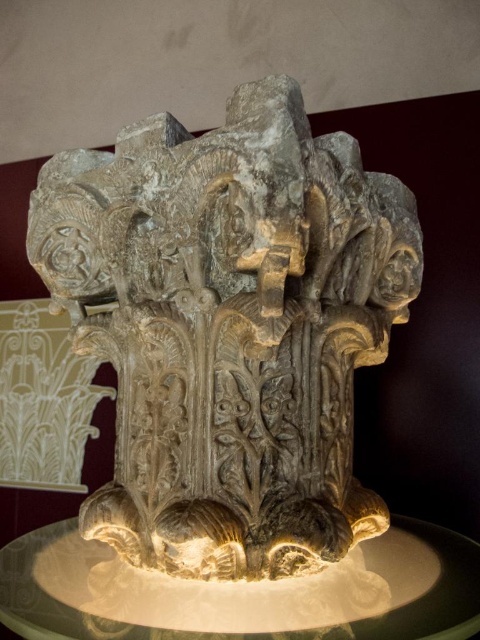
Does carved stone sculpture at center appear over satin gold pedestal at center?

Correct, carved stone sculpture at center is located above satin gold pedestal at center.

Can you confirm if carved stone sculpture at center is thinner than satin gold pedestal at center?

Yes.

Measure the distance between point (277, 392) and camera.

Point (277, 392) is 30.40 inches away from camera.

You are a GUI agent. You are given a task and a screenshot of the screen. Output one action in this format:
    pyautogui.click(x=<x>, y=<y>)
    Task: Click on the carved stone sculpture at center
    The image size is (480, 640).
    Given the screenshot: What is the action you would take?
    pyautogui.click(x=229, y=330)